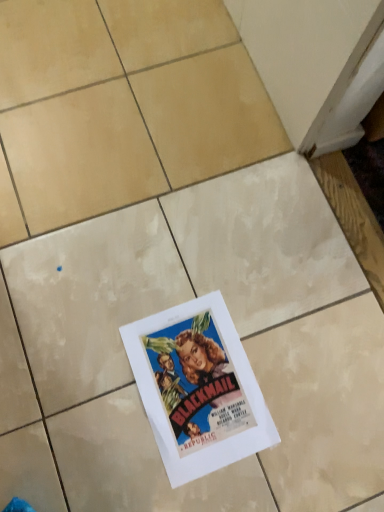
Locate an element on the screen. This screenshot has width=384, height=512. free space in front of matte paper poster at center is located at coordinates (172, 481).